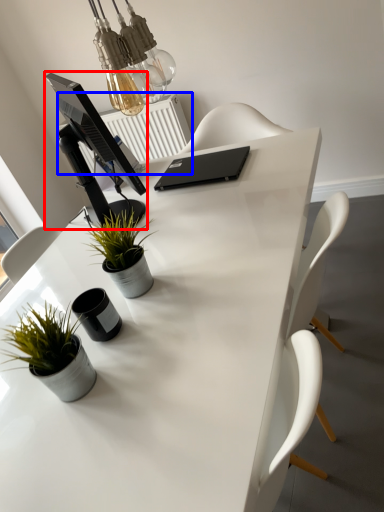
Question: Which object appears closest to the camera in this image, computer monitor (highlighted by a red box) or radiator (highlighted by a blue box)?

Choices:
 (A) computer monitor
 (B) radiator

Answer: (A)